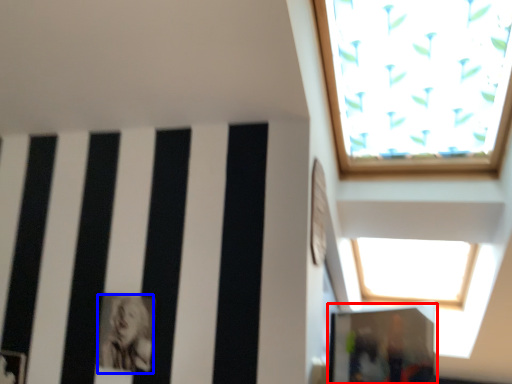
Question: Which object is further to the camera taking this photo, glass door (highlighted by a red box) or person (highlighted by a blue box)?

Choices:
 (A) glass door
 (B) person

Answer: (B)